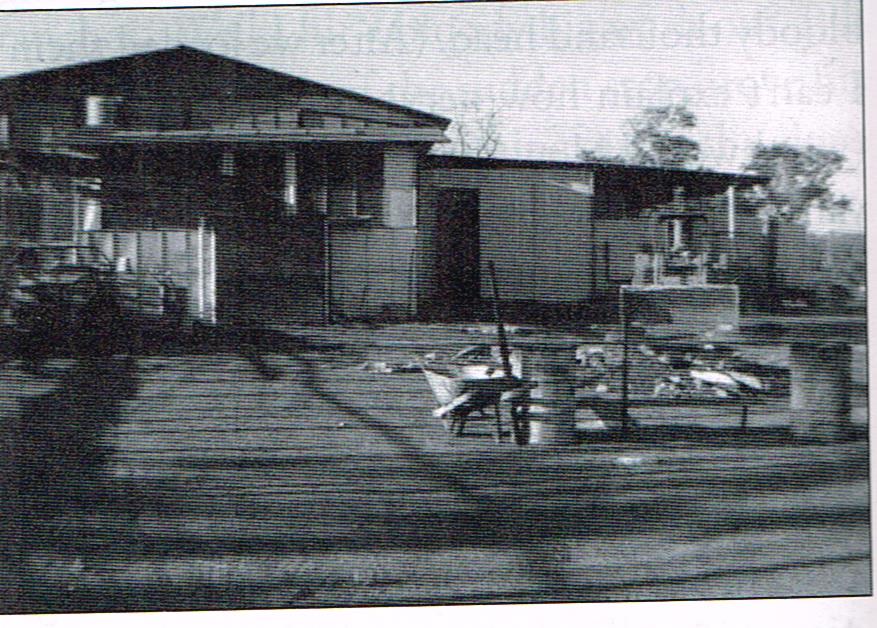
Image resolution: width=877 pixels, height=628 pixels. I want to click on wall, so click(x=553, y=223), click(x=365, y=266), click(x=159, y=267).